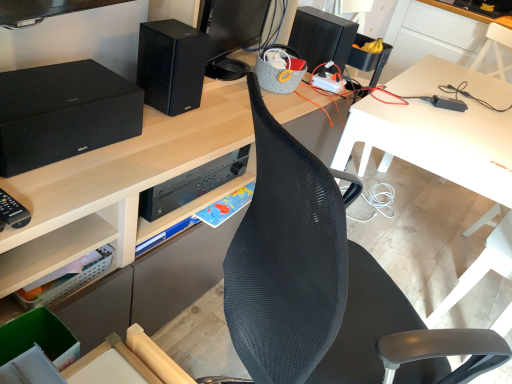
This screenshot has height=384, width=512. Describe the element at coordinates (170, 65) in the screenshot. I see `black matte speaker at upper center, the 2th speaker from the back` at that location.

Find the location of `black matte speaker at upper center, the 2th speaker from the back`. black matte speaker at upper center, the 2th speaker from the back is located at coordinates (170, 65).

What is the approximate height of matte black speaker at left, which appears as the third speaker when viewed from the right?

It is 15.95 centimeters.

At what (x,y) coordinates should I click in order to perform the action: click on matte black speaker at left, positioned as the 1th speaker in left-to-right order. Please return your answer as a coordinate pair (x, y). The image size is (512, 384). Looking at the image, I should click on (63, 113).

What do you see at coordinates (437, 145) in the screenshot? I see `white plastic table at center, the second table from the top` at bounding box center [437, 145].

This screenshot has height=384, width=512. In order to click on black matte speaker at upper right, arranged as the 1th speaker when viewed from the back in this screenshot , I will do `click(322, 37)`.

From the image's perspective, which object appears higher, clear plastic basket at lower left or black matte speaker at upper center, which is the second speaker from front to back?

black matte speaker at upper center, which is the second speaker from front to back, is shown above in the image.

Can you tell me how much clear plastic basket at lower left and black matte speaker at upper center, placed as the 2th speaker when sorted from left to right, differ in facing direction?

The angular difference between clear plastic basket at lower left and black matte speaker at upper center, placed as the 2th speaker when sorted from left to right, is 6.13 degrees.

Could you measure the distance between clear plastic basket at lower left and black matte speaker at upper center, which is the second speaker from front to back?

They are 51.66 centimeters apart.

Is clear plastic basket at lower left positioned behind black matte speaker at upper center, which ranks as the second speaker in right-to-left order?

No, it is in front of black matte speaker at upper center, which ranks as the second speaker in right-to-left order.

Can you confirm if white plastic table at upper right, which is counted as the 2th table, starting from the front, is taller than white plastic table at center, positioned as the first table in front-to-back order?

No.

Is white plastic table at upper right, which is counted as the 2th table, starting from the front, closer to the viewer compared to white plastic table at center, the second table from the top?

No, it is not.

Are white plastic table at upper right, the 2th table positioned from the bottom, and white plastic table at center, the second table from the top, far apart?

Yes, white plastic table at upper right, the 2th table positioned from the bottom, is far from white plastic table at center, the second table from the top.

Looking at this image, how many degrees apart are the facing directions of white plastic table at upper right, placed as the first table when sorted from top to bottom, and white plastic table at center, the second table in the back-to-front sequence?

They differ by 94.2 degrees in their facing directions.

You are a GUI agent. You are given a task and a screenshot of the screen. Output one action in this format:
    pyautogui.click(x=<x>, y=<y>)
    Task: Click on the 3rd speaker positioned below the white plastic table at upper right, the 2th table positioned from the bottom (from the image's perspective)
    
    Given the screenshot: What is the action you would take?
    pyautogui.click(x=63, y=113)

Can you confirm if white plastic table at upper right, which is counted as the 2th table, starting from the front, is positioned to the left of matte black speaker at left, arranged as the 3th speaker when viewed from the back?

No.

Based on the photo, is white plastic table at upper right, the 2th table positioned from the bottom, taller than matte black speaker at left, which appears as the third speaker when viewed from the right?

Yes, white plastic table at upper right, the 2th table positioned from the bottom, is taller than matte black speaker at left, which appears as the third speaker when viewed from the right.

Between black matte speaker at upper right, the 3th speaker in the left-to-right sequence, and black mesh chair at center, which one has more height?

With more height is black mesh chair at center.

Looking at this image, how different are the orientations of black matte speaker at upper right, marked as the 1th speaker in a right-to-left arrangement, and black mesh chair at center in degrees?

52 degrees separate the facing orientations of black matte speaker at upper right, marked as the 1th speaker in a right-to-left arrangement, and black mesh chair at center.

Is black matte speaker at upper right, the 3th speaker in the left-to-right sequence, located outside black mesh chair at center?

Indeed, black matte speaker at upper right, the 3th speaker in the left-to-right sequence, is completely outside black mesh chair at center.

From the image's perspective, would you say white plastic table at center, positioned as the first table in front-to-back order, is shown under black matte speaker at upper right, the 3th speaker in the left-to-right sequence?

Yes.

Considering their positions, is white plastic table at center, positioned as the first table in front-to-back order, located in front of or behind black matte speaker at upper right, arranged as the 1th speaker when viewed from the back?

In the image, white plastic table at center, positioned as the first table in front-to-back order, appears in front of black matte speaker at upper right, arranged as the 1th speaker when viewed from the back.

From the picture: Are white plastic table at center, which ranks as the 1th table in bottom-to-top order, and black matte speaker at upper right, the 3th speaker in the left-to-right sequence, far apart?

No, there isn't a large distance between white plastic table at center, which ranks as the 1th table in bottom-to-top order, and black matte speaker at upper right, the 3th speaker in the left-to-right sequence.

Is point (3, 133) farther from viewer compared to point (98, 227)?

No, it is in front of (98, 227).

From a real-world perspective, is matte black speaker at left, which appears as the third speaker when viewed from the right, located higher than clear plastic basket at lower left?

Yes, from a real-world perspective, matte black speaker at left, which appears as the third speaker when viewed from the right, is above clear plastic basket at lower left.

Does matte black speaker at left, which appears as the third speaker when viewed from the right, appear on the right side of clear plastic basket at lower left?

No, matte black speaker at left, which appears as the third speaker when viewed from the right, is not to the right of clear plastic basket at lower left.

Does matte black speaker at left, arranged as the 3th speaker when viewed from the back, lie in front of clear plastic basket at lower left?

Yes, it is in front of clear plastic basket at lower left.

In the scene shown: Would you say black matte speaker at upper center, placed as the 2th speaker when sorted from left to right, is outside matte black speaker at left, the first speaker positioned from the front?

Yes, black matte speaker at upper center, placed as the 2th speaker when sorted from left to right, is not within matte black speaker at left, the first speaker positioned from the front.

Is black matte speaker at upper center, placed as the 2th speaker when sorted from left to right, oriented away from matte black speaker at left, arranged as the 3th speaker when viewed from the back?

black matte speaker at upper center, placed as the 2th speaker when sorted from left to right, is not turned away from matte black speaker at left, arranged as the 3th speaker when viewed from the back.

Between black matte speaker at upper center, which ranks as the second speaker in right-to-left order, and matte black speaker at left, the first speaker positioned from the front, which one has larger size?

With larger size is matte black speaker at left, the first speaker positioned from the front.

Which speaker is the 1st one when counting from the back of the clear plastic basket at lower left? Please provide its 2D coordinates.

[(170, 65)]

Find the location of `table in front of the white plastic table at upper right, the 2th table positioned from the bottom`. table in front of the white plastic table at upper right, the 2th table positioned from the bottom is located at coordinates (437, 145).

Estimate the real-world distances between objects in this image. Which object is further from white plastic table at center, the second table from the top, matte black speaker at left, arranged as the 3th speaker when viewed from the back, or clear plastic basket at lower left?

clear plastic basket at lower left.

In the scene shown: Based on their spatial positions, is black matte speaker at upper right, marked as the 1th speaker in a right-to-left arrangement, or white plastic table at center, the second table from the top, closer to white plastic table at upper right, placed as the first table when sorted from top to bottom?

Among the two, white plastic table at center, the second table from the top, is located nearer to white plastic table at upper right, placed as the first table when sorted from top to bottom.

When comparing their distances from black mesh chair at center, does black matte speaker at upper center, placed as the 2th speaker when sorted from left to right, or white plastic table at upper right, which is counted as the 2th table, starting from the front, seem closer?

black matte speaker at upper center, placed as the 2th speaker when sorted from left to right, is closer to black mesh chair at center.

Looking at this image, which object lies further to the anchor point white plastic table at center, the second table from the top, black matte speaker at upper right, acting as the 3th speaker starting from the front, or matte black speaker at left, the first speaker positioned from the front?

matte black speaker at left, the first speaker positioned from the front, lies further to white plastic table at center, the second table from the top, than the other object.

From the image, which object appears to be nearer to black mesh chair at center, clear plastic basket at lower left or white plastic table at center, the second table from the top?

clear plastic basket at lower left is positioned closer to the anchor black mesh chair at center.

Estimate the real-world distances between objects in this image. Which object is closer to matte black speaker at left, which appears as the third speaker when viewed from the right, white plastic table at upper right, which is counted as the 2th table, starting from the front, or black mesh chair at center?

black mesh chair at center is positioned closer to the anchor matte black speaker at left, which appears as the third speaker when viewed from the right.

Which object lies nearer to the anchor point black mesh chair at center, black matte speaker at upper center, placed as the 2th speaker when sorted from left to right, or clear plastic basket at lower left?

clear plastic basket at lower left lies closer to black mesh chair at center than the other object.

From the image, which object appears to be farther from matte black speaker at left, positioned as the 1th speaker in left-to-right order, white plastic table at upper right, which is counted as the 2th table, starting from the front, or black matte speaker at upper center, placed as the 2th speaker when sorted from left to right?

white plastic table at upper right, which is counted as the 2th table, starting from the front.

Find the location of a particular element. The height and width of the screenshot is (384, 512). chair between matte black speaker at left, which appears as the third speaker when viewed from the right, and white plastic table at center, which ranks as the 1th table in bottom-to-top order, in the horizontal direction is located at coordinates (325, 284).

Identify the location of shelf between black mesh chair at center and black matte speaker at upper right, arranged as the 1th speaker when viewed from the back, along the z-axis. Image resolution: width=512 pixels, height=384 pixels. (52, 251).

Where is `table between matte black speaker at left, arranged as the 3th speaker when viewed from the back, and white plastic table at upper right, which is counted as the 2th table, starting from the front, in the horizontal direction`? The width and height of the screenshot is (512, 384). table between matte black speaker at left, arranged as the 3th speaker when viewed from the back, and white plastic table at upper right, which is counted as the 2th table, starting from the front, in the horizontal direction is located at coordinates (437, 145).

This screenshot has height=384, width=512. In order to click on shelf between matte black speaker at left, positioned as the 1th speaker in left-to-right order, and white plastic table at center, the second table from the top, in the horizontal direction in this screenshot , I will do `click(52, 251)`.